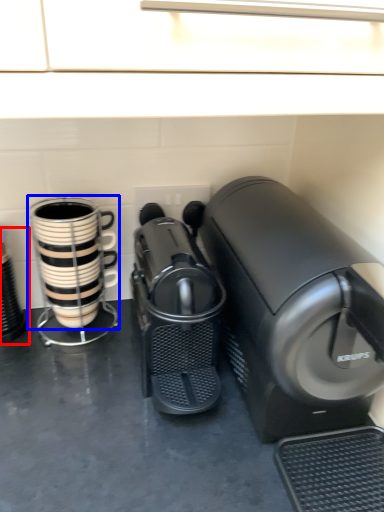
Question: Which point is further to the camera, appliance (highlighted by a red box) or coffee cup (highlighted by a blue box)?

Choices:
 (A) appliance
 (B) coffee cup

Answer: (A)